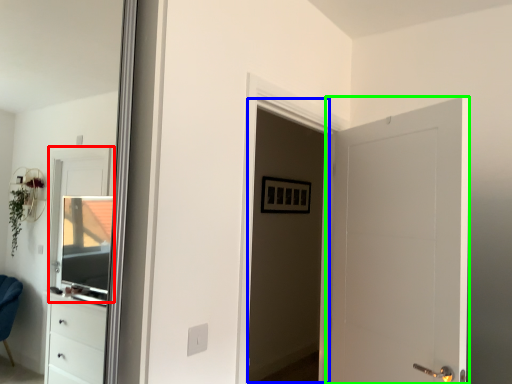
Question: Considering the real-world distances, which object is farthest from window (highlighted by a red box)? screen door (highlighted by a blue box) or door (highlighted by a green box)?

Choices:
 (A) screen door
 (B) door

Answer: (B)